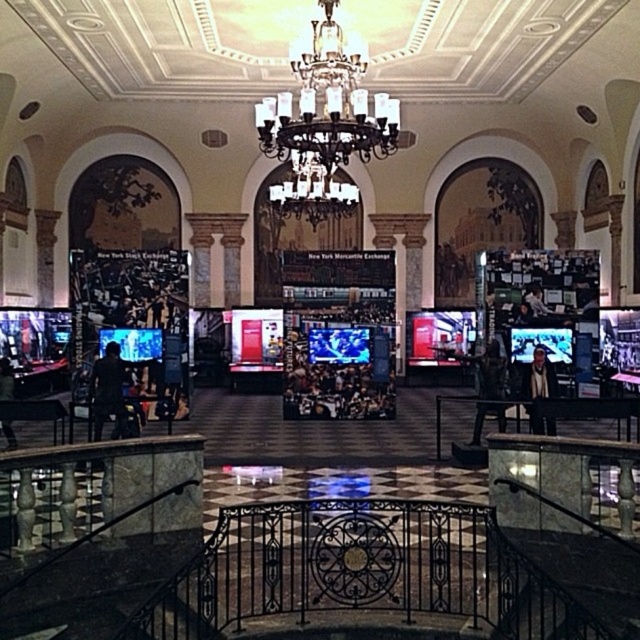
Question: Based on their relative distances, which object is farther from the black leather jacket at lower left?

Choices:
 (A) dark fabric jacket at lower left
 (B) light brown leather jacket at center

Answer: (B)

Question: Where is crystal glass chandelier at center located in relation to dark gray suit at center in the image?

Choices:
 (A) below
 (B) above

Answer: (B)

Question: Does crystal glass chandelier at center appear over light brown leather jacket at center?

Choices:
 (A) yes
 (B) no

Answer: (A)

Question: Is crystal glass chandelier at center wider than dark gray suit at center?

Choices:
 (A) yes
 (B) no

Answer: (A)

Question: Based on their relative distances, which object is nearer to the crystal glass chandelier at center?

Choices:
 (A) dark fabric jacket at lower left
 (B) light brown leather jacket at center
 (C) black leather jacket at lower left
 (D) dark gray suit at center

Answer: (B)

Question: Which point is farther from the camera taking this photo?

Choices:
 (A) (4, 360)
 (B) (476, 376)

Answer: (B)